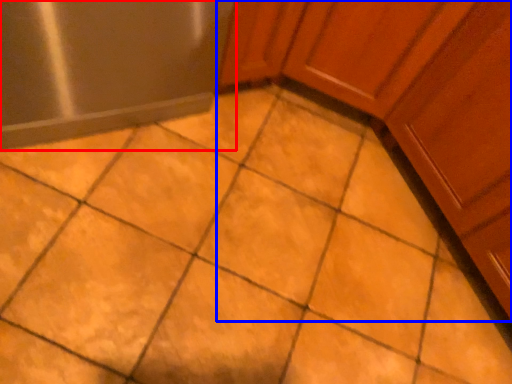
Question: Which of the following is the farthest to the observer, appliance (highlighted by a red box) or cabinetry (highlighted by a blue box)?

Choices:
 (A) appliance
 (B) cabinetry

Answer: (A)